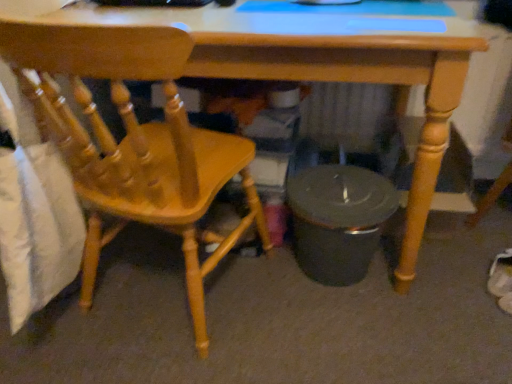
I want to click on vacant space to the right of matte wood chair at left, so click(x=315, y=331).